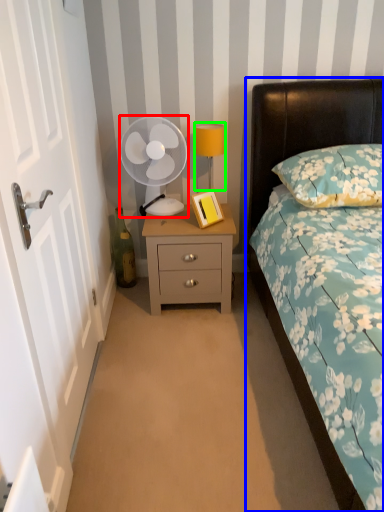
Question: Based on their relative distances, which object is nearer to mechanical fan (highlighted by a red box)? Choose from bed (highlighted by a blue box) and bedside lamp (highlighted by a green box).

Choices:
 (A) bed
 (B) bedside lamp

Answer: (B)